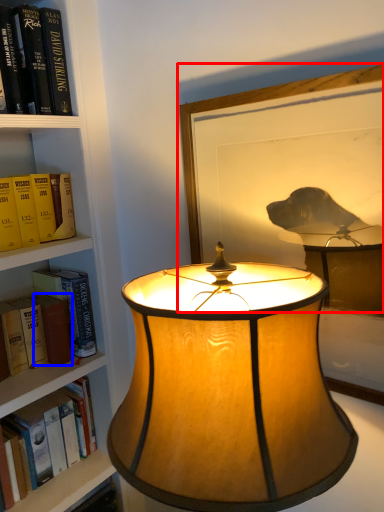
Question: Which object appears closest to the camera in this image, picture frame (highlighted by a red box) or paperback book (highlighted by a blue box)?

Choices:
 (A) picture frame
 (B) paperback book

Answer: (A)